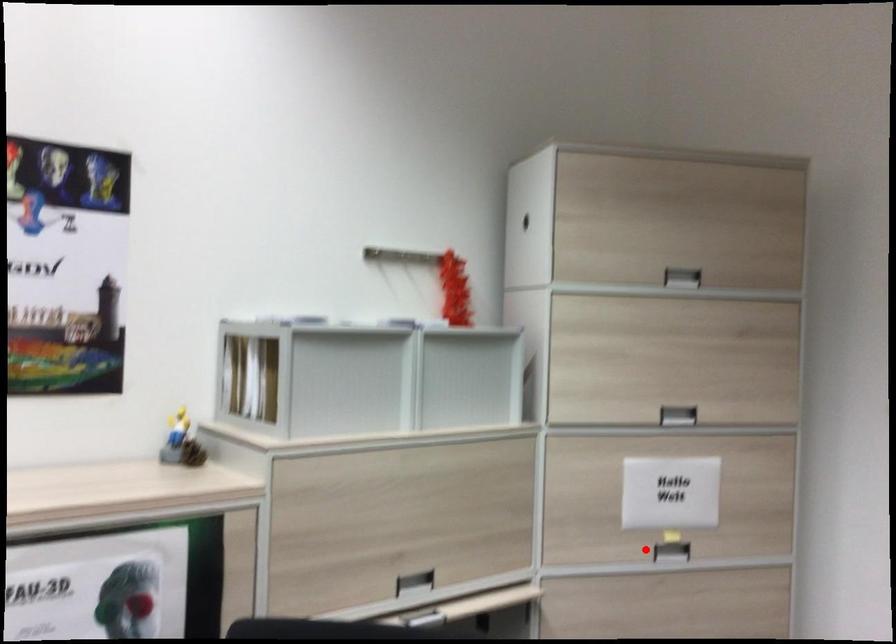
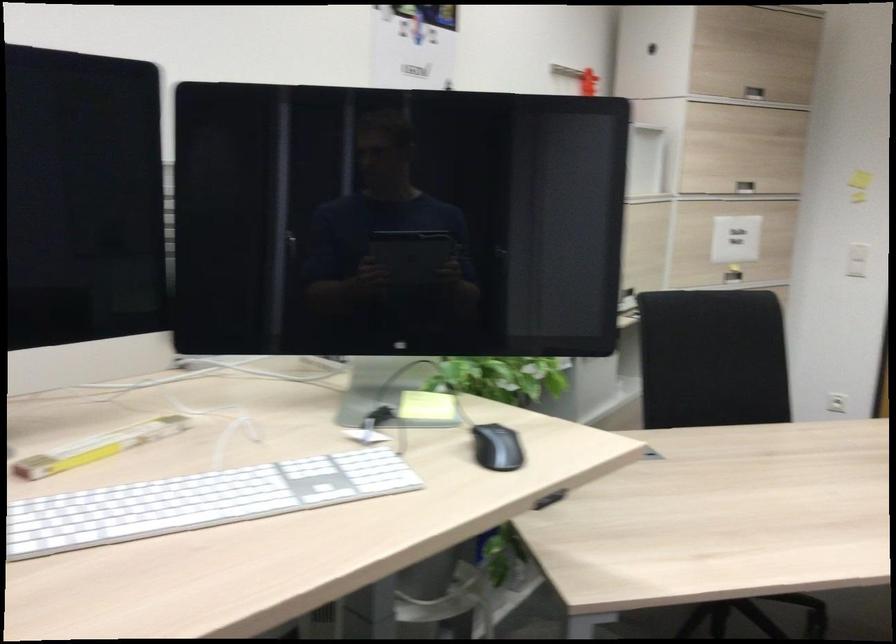
In the second image, find the point that corresponds to the highlighted location in the first image.

(733, 275)